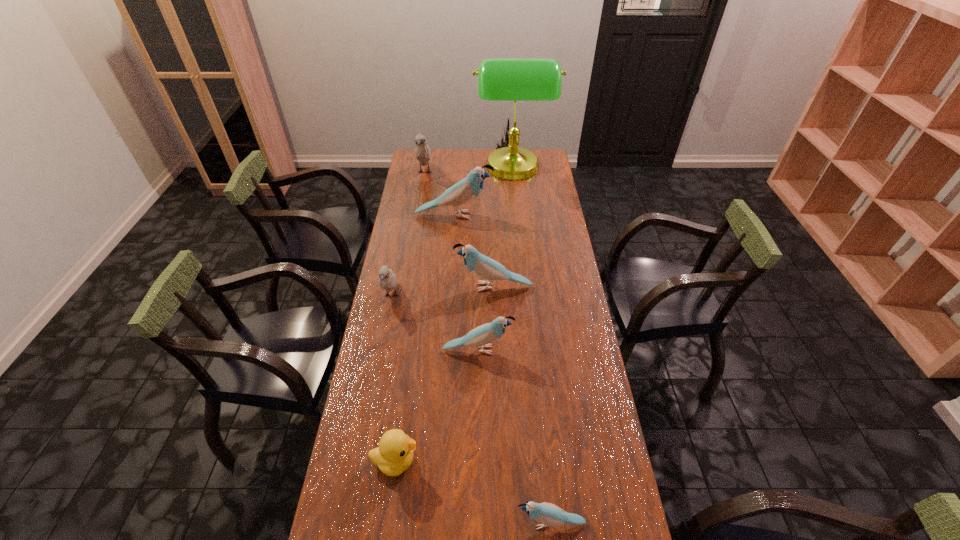
In order to click on the tallest object in this screenshot , I will do `click(499, 79)`.

You are a GUI agent. You are given a task and a screenshot of the screen. Output one action in this format:
    pyautogui.click(x=<x>, y=<y>)
    Task: Click on the green lamp
    Image resolution: width=960 pixels, height=540 pixels.
    Given the screenshot: What is the action you would take?
    click(499, 79)

Where is `the sixth nearest object`? The height and width of the screenshot is (540, 960). the sixth nearest object is located at coordinates (467, 189).

The image size is (960, 540). Identify the location of the biggest blue bird. (467, 189).

Where is `the farthest bird`? This screenshot has height=540, width=960. the farthest bird is located at coordinates (422, 151).

What are the coordinates of `the bigger white bird` in the screenshot? It's located at (422, 151).

At what (x,y) coordinates should I click in order to perform the action: click on the second biggest blue bird. Please return your answer as a coordinate pair (x, y). This screenshot has height=540, width=960. Looking at the image, I should click on [480, 265].

Where is `the nearer white bird`? the nearer white bird is located at coordinates (388, 280).

The image size is (960, 540). In order to click on the second nearest bird in this screenshot , I will do `click(481, 336)`.

Find the location of a particular element. the second smallest blue bird is located at coordinates (481, 336).